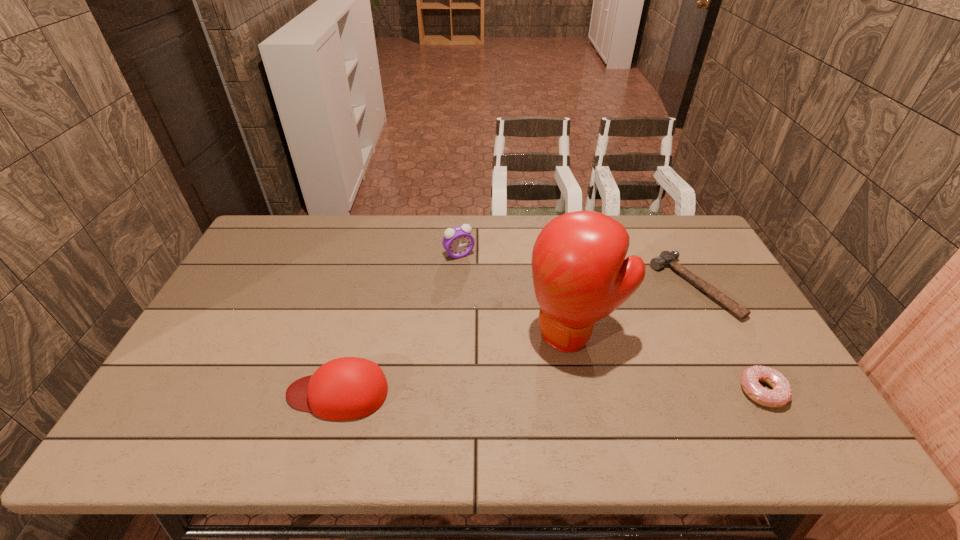
In the image, there is a desktop. Identify the location of free region at the near left corner. (158, 403).

This screenshot has width=960, height=540. Identify the location of free region at the near right corner of the desktop. 732,383.

You are a GUI agent. You are given a task and a screenshot of the screen. Output one action in this format:
    pyautogui.click(x=<x>, y=<y>)
    Task: Click on the blank region between the tallest object and the hammer
    
    Given the screenshot: What is the action you would take?
    pyautogui.click(x=634, y=310)

The width and height of the screenshot is (960, 540). In order to click on free space between the doughnut and the second object from left to right in this screenshot , I will do pyautogui.click(x=611, y=323).

Where is `vacant space in between the third object from right to left and the hammer`? vacant space in between the third object from right to left and the hammer is located at coordinates (634, 310).

You are a GUI agent. You are given a task and a screenshot of the screen. Output one action in this format:
    pyautogui.click(x=<x>, y=<y>)
    Task: Click on the unoccupied area between the boxing glove and the leftmost object
    
    Given the screenshot: What is the action you would take?
    pyautogui.click(x=456, y=363)

Locate an element on the screen. This screenshot has height=540, width=960. free space between the leftmost object and the hammer is located at coordinates (516, 340).

Locate an element on the screen. The width and height of the screenshot is (960, 540). vacant area that lies between the hammer and the baseball cap is located at coordinates (516, 340).

Find the location of `unoccupied position between the doughnut and the hammer`. unoccupied position between the doughnut and the hammer is located at coordinates (728, 339).

Locate an element on the screen. This screenshot has width=960, height=540. free space between the alarm clock and the leftmost object is located at coordinates point(398,323).